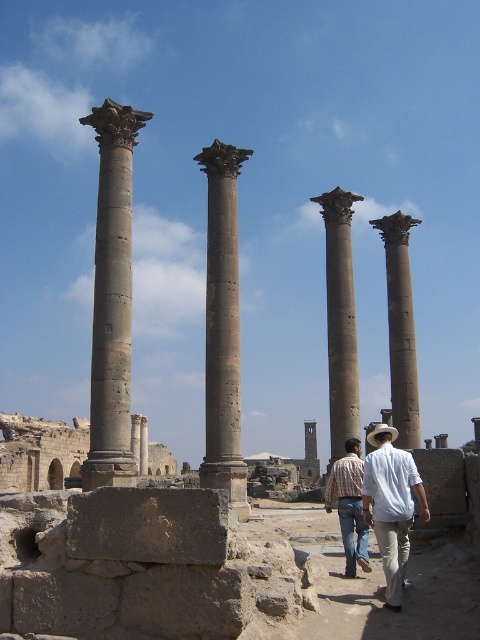
Which is below, dark gray stone arch at center or white cotton shirt at center?

dark gray stone arch at center

Between dark gray stone arch at center and white cotton shirt at center, which one appears on the right side from the viewer's perspective?

white cotton shirt at center

Locate an element on the screen. dark gray stone arch at center is located at coordinates (40, 452).

Locate an element on the screen. The height and width of the screenshot is (640, 480). dark gray stone arch at center is located at coordinates (40, 452).

Can you confirm if dark gray stone arch at center is positioned to the left of smooth stone column at right?

Indeed, dark gray stone arch at center is positioned on the left side of smooth stone column at right.

Between point (39, 419) and point (411, 397), which one is positioned behind?

The point (39, 419) is more distant.

The height and width of the screenshot is (640, 480). Identify the location of dark gray stone arch at center. (40, 452).

At what (x,y) coordinates should I click in order to perform the action: click on gray stone column at left. Please return your answer as a coordinate pair (x, y). This screenshot has height=640, width=480. Looking at the image, I should click on (111, 298).

Does gray stone column at left have a smaller size compared to dark gray stone arch at center?

Indeed, gray stone column at left has a smaller size compared to dark gray stone arch at center.

What do you see at coordinates (111, 298) in the screenshot? I see `gray stone column at left` at bounding box center [111, 298].

The image size is (480, 640). What are the coordinates of `gray stone column at left` in the screenshot? It's located at (111, 298).